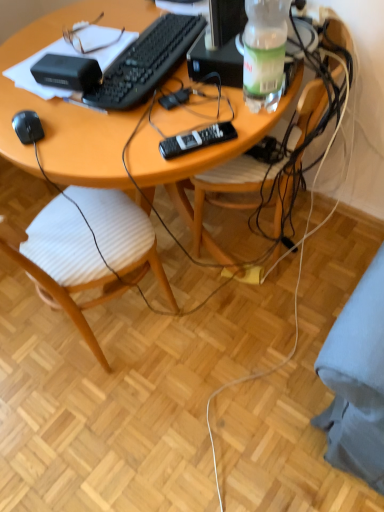
This screenshot has width=384, height=512. Find the location of `free space between wooden chair at center, which is counted as the second chair, starting from the right, and wooden chair at center, the first chair from the right`. free space between wooden chair at center, which is counted as the second chair, starting from the right, and wooden chair at center, the first chair from the right is located at coordinates (197, 285).